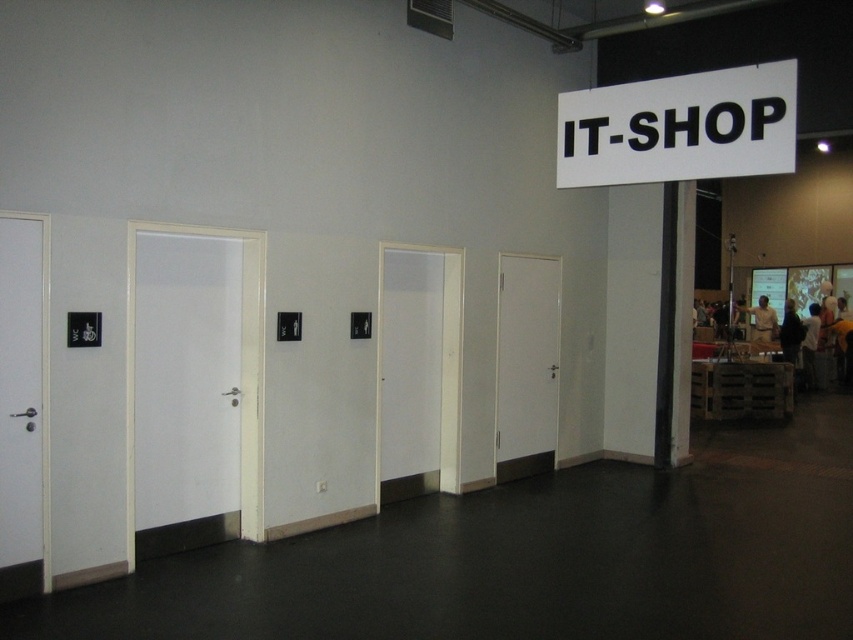
Who is taller, white plastic sign at upper center or white glossy door at left?

Standing taller between the two is white glossy door at left.

Is white plastic sign at upper center shorter than white glossy door at left?

Indeed, white plastic sign at upper center has a lesser height compared to white glossy door at left.

The height and width of the screenshot is (640, 853). What are the coordinates of `white plastic sign at upper center` in the screenshot? It's located at (679, 128).

This screenshot has height=640, width=853. What are the coordinates of `white plastic sign at upper center` in the screenshot? It's located at (679, 128).

Is white matte door at left closer to the viewer compared to white matte door at center?

Yes, it is.

The width and height of the screenshot is (853, 640). What are the coordinates of `white matte door at left` in the screenshot? It's located at (184, 378).

How much distance is there between white matte door at left and white glossy door at left?

white matte door at left is 39.20 inches away from white glossy door at left.

Between point (206, 451) and point (4, 323), which one is positioned in front?

Point (4, 323)

Find the location of a particular element. The height and width of the screenshot is (640, 853). white matte door at left is located at coordinates (184, 378).